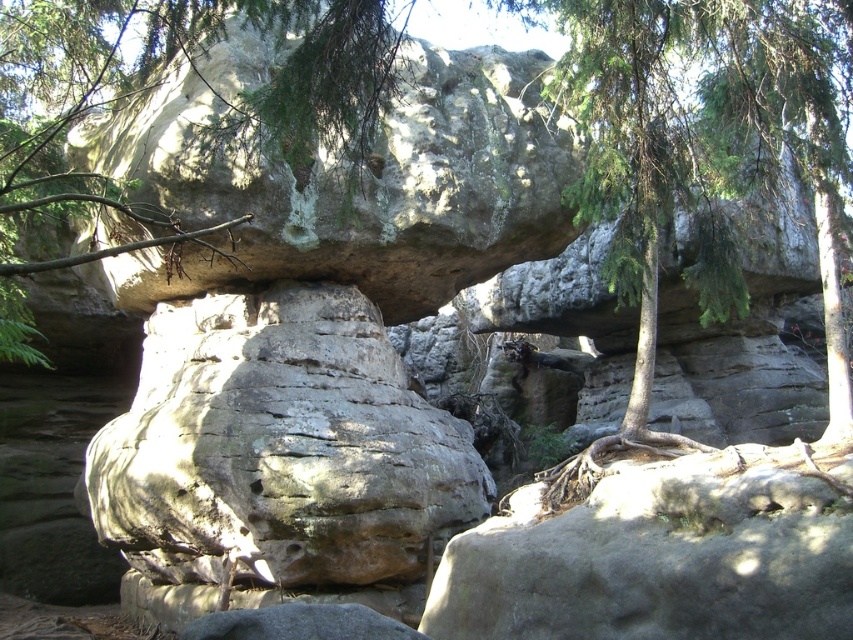
Question: Considering the relative positions of rough textured rock at center and green textured rock at upper center in the image provided, where is rough textured rock at center located with respect to green textured rock at upper center?

Choices:
 (A) above
 (B) below

Answer: (B)

Question: Does rough textured rock at center have a larger size compared to green textured rock at upper center?

Choices:
 (A) yes
 (B) no

Answer: (B)

Question: Is rough textured rock at center further to camera compared to green textured rock at upper center?

Choices:
 (A) no
 (B) yes

Answer: (B)